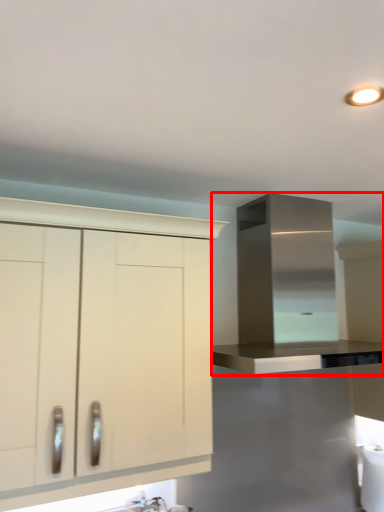
Question: Observing the image, what is the correct spatial positioning of cabinetry (annotated by the red box) in reference to cabinetry?

Choices:
 (A) left
 (B) right

Answer: (B)